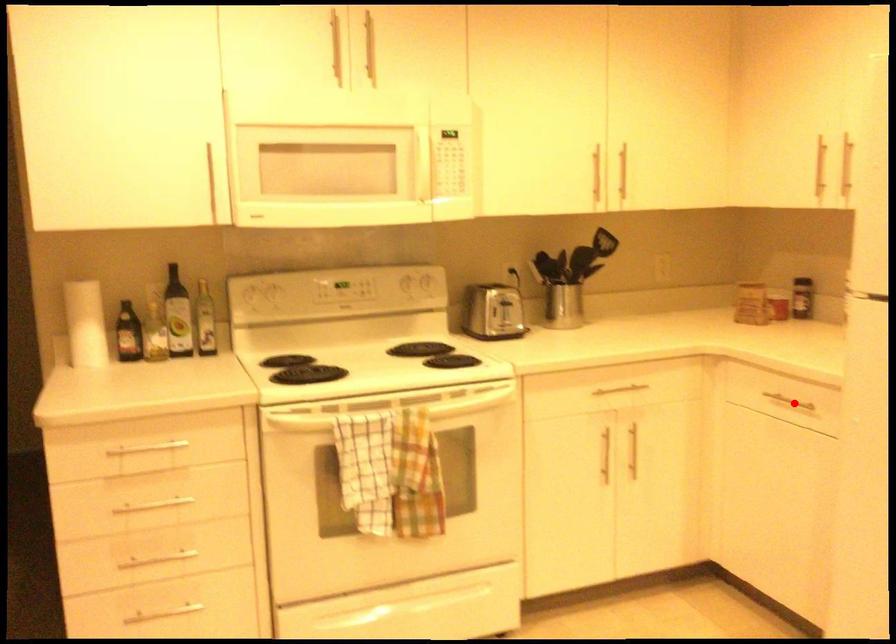
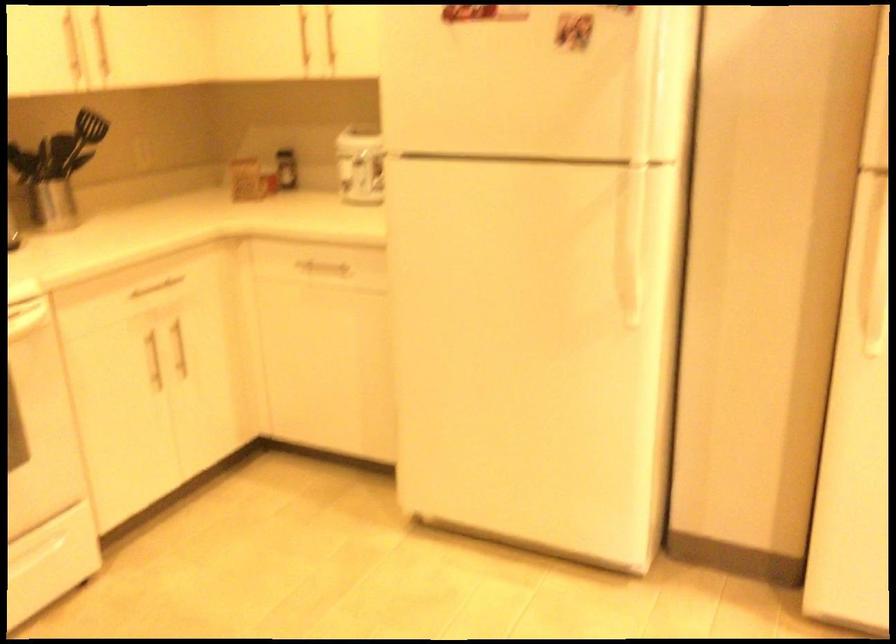
Where in the second image is the point corresponding to the highlighted location from the first image?

(323, 268)